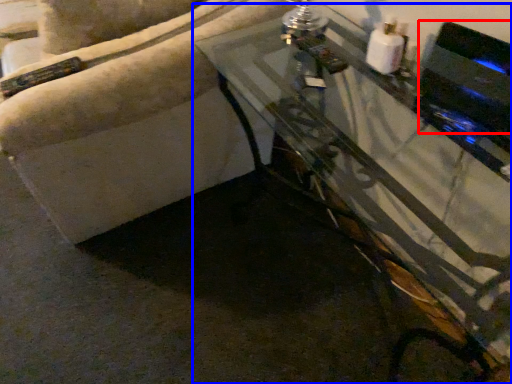
Question: Which of the following is the farthest to the observer, appliance (highlighted by a red box) or table (highlighted by a blue box)?

Choices:
 (A) appliance
 (B) table

Answer: (A)